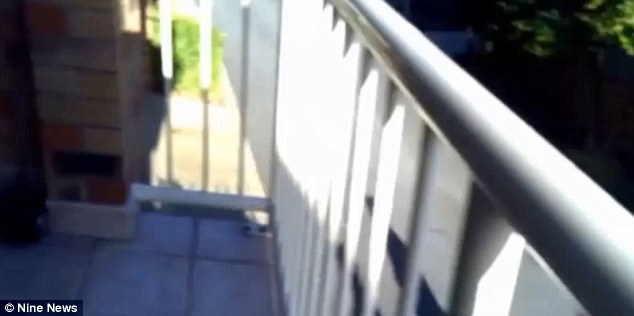
Identify the location of right side brick pillar. (126, 83).